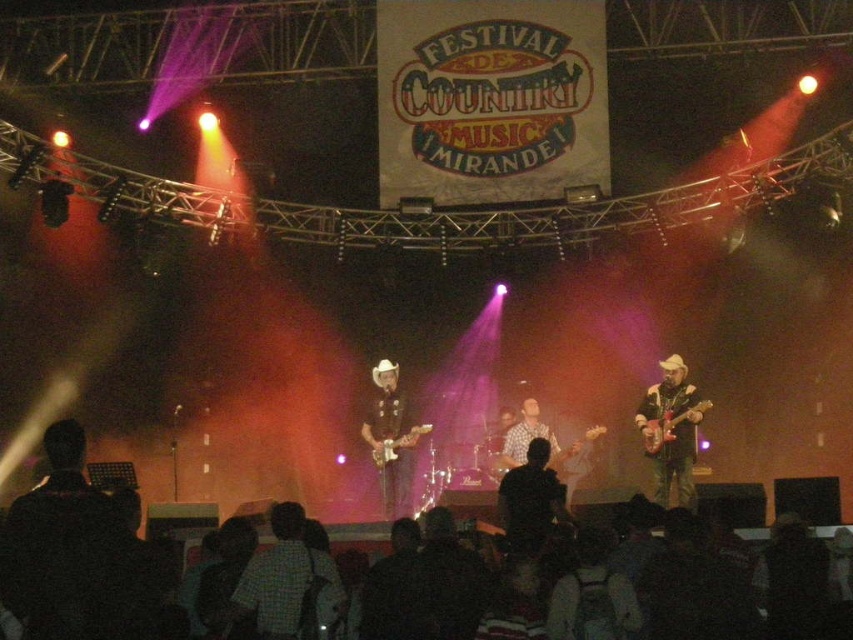
Question: Is shiny brown guitar at right closer to camera compared to glossy wood guitar at center-right?

Choices:
 (A) yes
 (B) no

Answer: (A)

Question: Does shiny brown guitar at right have a smaller size compared to wooden acoustic guitar at center?

Choices:
 (A) yes
 (B) no

Answer: (B)

Question: Which object is closer to the camera taking this photo?

Choices:
 (A) shiny brown guitar at right
 (B) glossy wood guitar at center
 (C) wooden acoustic guitar at center
 (D) glossy wood guitar at center-right

Answer: (A)

Question: Observing the image, what is the correct spatial positioning of shiny brown guitar at right in reference to glossy wood guitar at center-right?

Choices:
 (A) above
 (B) below

Answer: (B)

Question: Which point is closer to the camera taking this photo?

Choices:
 (A) (389, 440)
 (B) (370, 451)
 (C) (593, 428)
 (D) (648, 445)

Answer: (D)

Question: Which point appears farthest from the camera in this image?

Choices:
 (A) (643, 403)
 (B) (372, 412)

Answer: (B)